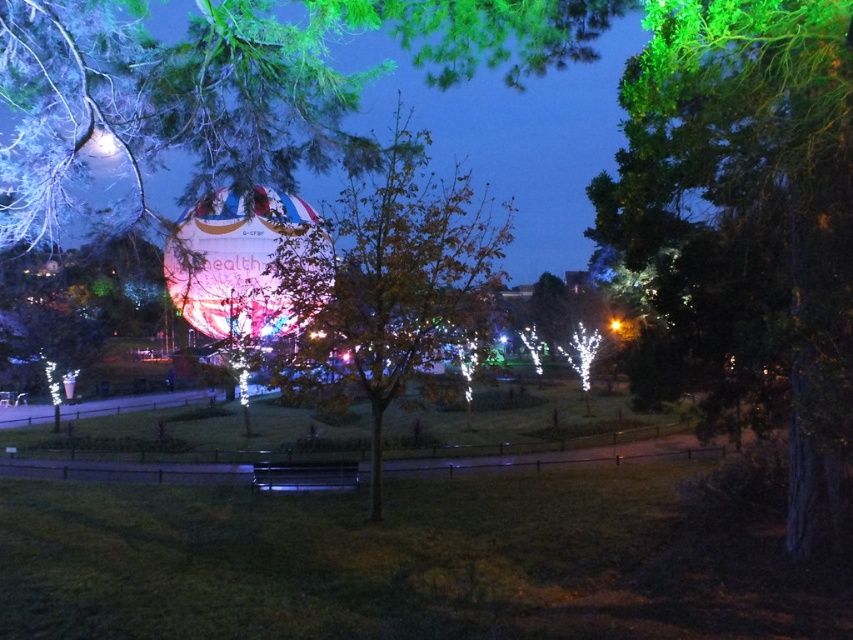
Question: Among these objects, which one is farthest from the camera?

Choices:
 (A) orange leafy tree at center
 (B) green leafy tree at right

Answer: (A)

Question: In this image, where is green leafy tree at right located relative to metallic silver bench at center?

Choices:
 (A) right
 (B) left

Answer: (A)

Question: Which point is farther from the camera taking this photo?

Choices:
 (A) (280, 276)
 (B) (277, 461)
 (C) (811, 77)

Answer: (B)

Question: Does green leafy tree at right have a greater width compared to orange leafy tree at center?

Choices:
 (A) yes
 (B) no

Answer: (B)

Question: Which point is closer to the camera taking this photo?

Choices:
 (A) (715, 324)
 (B) (328, 332)

Answer: (A)

Question: Does green leafy tree at right appear on the right side of metallic silver bench at center?

Choices:
 (A) no
 (B) yes

Answer: (B)